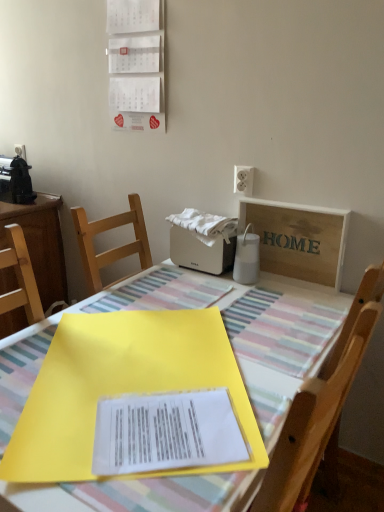
In order to click on vacant space that is in between wooden sign at upper right and yellow paper at center in this screenshot , I will do [x=269, y=322].